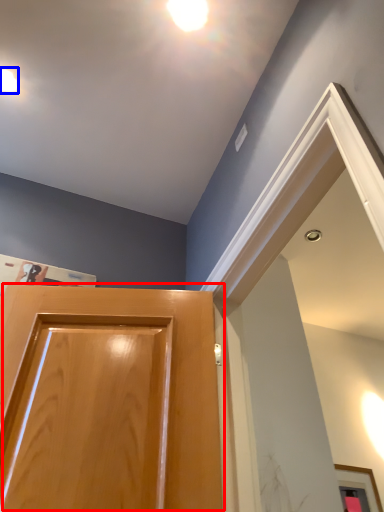
Question: Which of the following is the closest to the observer, door (highlighted by a red box) or droplight (highlighted by a blue box)?

Choices:
 (A) door
 (B) droplight

Answer: (A)